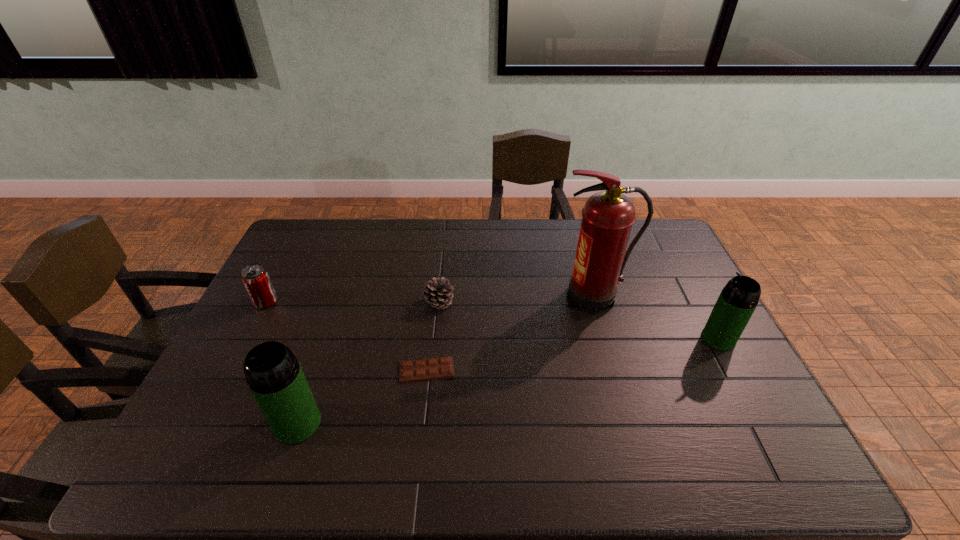
Find the location of a particular element. The height and width of the screenshot is (540, 960). spot to insert another thermos_bottle for uniform distribution is located at coordinates (526, 377).